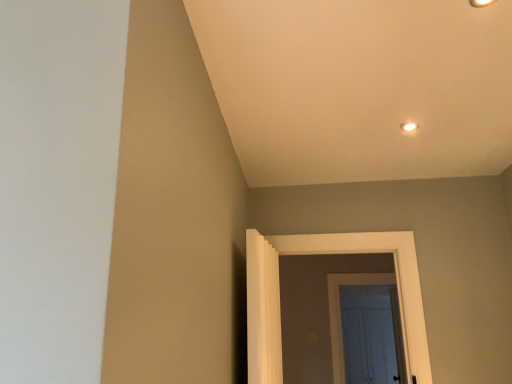
Question: Is white glossy light fixture at upper center, which is the second light fixture from top to bottom, placed right next to white wooden door at center, arranged as the 2th door when viewed from the left?

Choices:
 (A) no
 (B) yes

Answer: (A)

Question: Can you confirm if white glossy light fixture at upper center, which is the second light fixture from top to bottom, is wider than white wooden door at center, arranged as the 2th door when viewed from the left?

Choices:
 (A) yes
 (B) no

Answer: (B)

Question: Is white glossy light fixture at upper center, which ranks as the first light fixture in bottom-to-top order, thinner than white wooden door at center, marked as the 1th door in a back-to-front arrangement?

Choices:
 (A) no
 (B) yes

Answer: (B)

Question: Is white glossy light fixture at upper center, placed as the 2th light fixture when sorted from front to back, outside of white wooden door at center, positioned as the 1th door in right-to-left order?

Choices:
 (A) no
 (B) yes

Answer: (B)

Question: Is white glossy light fixture at upper center, which ranks as the first light fixture in bottom-to-top order, positioned behind white wooden door at center, marked as the 1th door in a back-to-front arrangement?

Choices:
 (A) yes
 (B) no

Answer: (B)

Question: Can you confirm if white glossy light fixture at upper center, which ranks as the first light fixture in bottom-to-top order, is positioned to the left of white wooden door at center, the 2th door from the front?

Choices:
 (A) no
 (B) yes

Answer: (B)

Question: Would you consider white wooden door at center, arranged as the 2th door when viewed from the left, to be distant from matte gold light fixture at upper right, the 1th light fixture viewed from the front?

Choices:
 (A) yes
 (B) no

Answer: (A)

Question: From a real-world perspective, is white wooden door at center, the 2th door from the front, beneath matte gold light fixture at upper right, marked as the first light fixture in a top-to-bottom arrangement?

Choices:
 (A) yes
 (B) no

Answer: (A)

Question: Considering the relative sizes of white wooden door at center, positioned as the 1th door in right-to-left order, and matte gold light fixture at upper right, the second light fixture viewed from the back, in the image provided, is white wooden door at center, positioned as the 1th door in right-to-left order, taller than matte gold light fixture at upper right, the second light fixture viewed from the back,?

Choices:
 (A) no
 (B) yes

Answer: (B)

Question: From a real-world perspective, is white wooden door at center, arranged as the 2th door when viewed from the left, on top of matte gold light fixture at upper right, the 1th light fixture viewed from the front?

Choices:
 (A) yes
 (B) no

Answer: (B)

Question: Could you tell me if white wooden door at center, arranged as the 2th door when viewed from the left, is facing matte gold light fixture at upper right, the 1th light fixture viewed from the front?

Choices:
 (A) no
 (B) yes

Answer: (B)

Question: Is white wooden door at center, positioned as the 1th door in right-to-left order, positioned behind matte gold light fixture at upper right, marked as the first light fixture in a top-to-bottom arrangement?

Choices:
 (A) no
 (B) yes

Answer: (B)

Question: Can you confirm if matte gold light fixture at upper right, which is counted as the second light fixture, starting from the bottom, is thinner than white painted wood door at center, arranged as the first door when viewed from the front?

Choices:
 (A) no
 (B) yes

Answer: (B)